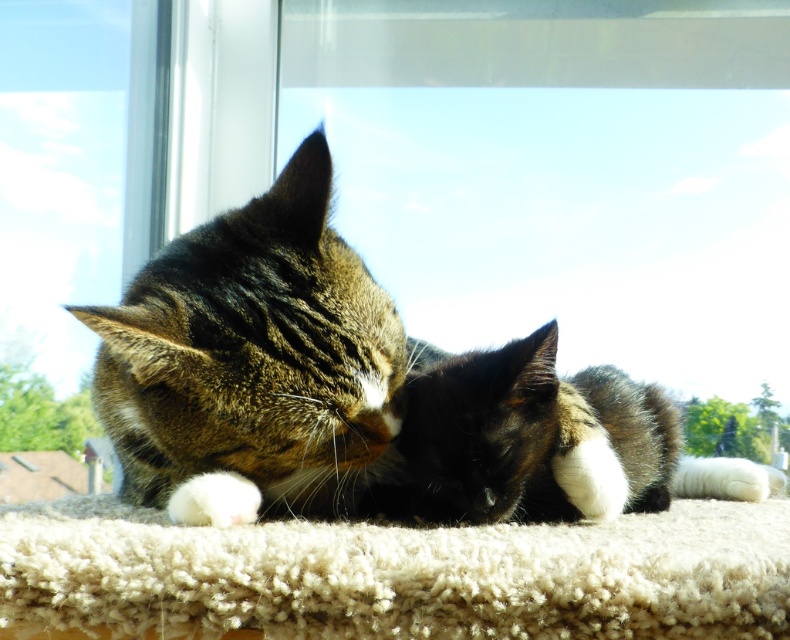
Question: Can you confirm if beige shaggy carpet at lower center is positioned to the right of black fur at center?

Choices:
 (A) no
 (B) yes

Answer: (A)

Question: Can you confirm if beige shaggy carpet at lower center is positioned to the left of black fur at center?

Choices:
 (A) yes
 (B) no

Answer: (A)

Question: Is tabby fur cat at center further to the viewer compared to black fur at center?

Choices:
 (A) yes
 (B) no

Answer: (B)

Question: Based on their relative distances, which object is nearer to the beige shaggy carpet at lower center?

Choices:
 (A) black fur at center
 (B) tabby fur cat at center

Answer: (B)

Question: Among these objects, which one is nearest to the camera?

Choices:
 (A) tabby fur cat at center
 (B) black fur at center
 (C) beige shaggy carpet at lower center

Answer: (C)

Question: Estimate the real-world distances between objects in this image. Which object is closer to the tabby fur cat at center?

Choices:
 (A) black fur at center
 (B) beige shaggy carpet at lower center

Answer: (A)